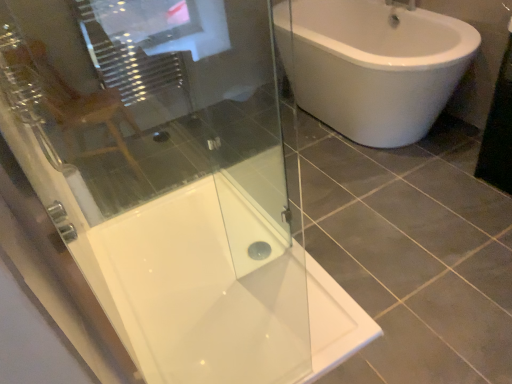
Describe the element at coordinates (78, 106) in the screenshot. I see `matte wooden chair at upper left` at that location.

The height and width of the screenshot is (384, 512). Describe the element at coordinates (165, 173) in the screenshot. I see `transparent glass shower door at upper left` at that location.

Where is `white glossy shower tray at center`? Image resolution: width=512 pixels, height=384 pixels. white glossy shower tray at center is located at coordinates (220, 299).

Where is `matte wooden chair at upper left`? The width and height of the screenshot is (512, 384). matte wooden chair at upper left is located at coordinates (78, 106).

From the image's perspective, who appears lower, matte wooden chair at upper left or transparent glass shower door at upper left?

transparent glass shower door at upper left.

Find the location of `gray behind the transparent glass shower door at upper left`. gray behind the transparent glass shower door at upper left is located at coordinates (78, 106).

Considering the sizes of objects matte wooden chair at upper left and transparent glass shower door at upper left in the image provided, who is shorter, matte wooden chair at upper left or transparent glass shower door at upper left?

matte wooden chair at upper left is shorter.

From a real-world perspective, which is physically below, matte wooden chair at upper left or transparent glass shower door at upper left?

From a 3D spatial view, matte wooden chair at upper left is below.

From the picture: Is transparent glass shower door at upper left next to white glossy shower tray at center?

No, transparent glass shower door at upper left is not with white glossy shower tray at center.

From the image's perspective, which is above, transparent glass shower door at upper left or white glossy shower tray at center?

transparent glass shower door at upper left, from the image's perspective.

From a real-world perspective, between transparent glass shower door at upper left and white glossy shower tray at center, who is vertically lower?

white glossy shower tray at center.

Considering the sizes of transparent glass shower door at upper left and white glossy shower tray at center in the image, is transparent glass shower door at upper left taller or shorter than white glossy shower tray at center?

transparent glass shower door at upper left is taller than white glossy shower tray at center.

Is transparent glass shower door at upper left inside or outside of matte wooden chair at upper left?

transparent glass shower door at upper left lies outside matte wooden chair at upper left.

Is transparent glass shower door at upper left placed right next to matte wooden chair at upper left?

No, transparent glass shower door at upper left is not next to matte wooden chair at upper left.

Looking at this image, in the image, is transparent glass shower door at upper left positioned in front of or behind matte wooden chair at upper left?

In the image, transparent glass shower door at upper left appears in front of matte wooden chair at upper left.

Can you see white glossy shower tray at center touching transparent glass shower door at upper left?

white glossy shower tray at center and transparent glass shower door at upper left are not in contact.

Consider the image. From a real-world perspective, is white glossy shower tray at center on transparent glass shower door at upper left?

Actually, white glossy shower tray at center is physically below transparent glass shower door at upper left in the real world.

Would you say white glossy shower tray at center contains transparent glass shower door at upper left?

Definitely not — transparent glass shower door at upper left is not inside white glossy shower tray at center.

Considering the positions of points (292, 263) and (121, 263), is point (292, 263) closer to camera compared to point (121, 263)?

Yes, it is.

Between white glossy shower tray at center and matte wooden chair at upper left, which one appears on the left side from the viewer's perspective?

Positioned to the left is matte wooden chair at upper left.

From a real-world perspective, between white glossy shower tray at center and matte wooden chair at upper left, who is vertically lower?

white glossy shower tray at center.

In terms of height, does white glossy shower tray at center look taller or shorter compared to matte wooden chair at upper left?

In the image, white glossy shower tray at center appears to be shorter than matte wooden chair at upper left.

Is white glossy shower tray at center placed right next to matte wooden chair at upper left?

white glossy shower tray at center and matte wooden chair at upper left are not in contact.

Is matte wooden chair at upper left turned away from white glossy shower tray at center?

No, white glossy shower tray at center is not at the back of matte wooden chair at upper left.

From a real-world perspective, does matte wooden chair at upper left sit lower than white glossy shower tray at center?

No, from a real-world perspective, matte wooden chair at upper left is not beneath white glossy shower tray at center.

Is the depth of matte wooden chair at upper left greater than that of white glossy shower tray at center?

Yes, matte wooden chair at upper left is further from the viewer.

You are a GUI agent. You are given a task and a screenshot of the screen. Output one action in this format:
    pyautogui.click(x=<x>, y=<y>)
    Task: Click on the screen door that is above the matte wooden chair at upper left (from a real-world perspective)
    This screenshot has width=512, height=384.
    Given the screenshot: What is the action you would take?
    click(x=165, y=173)

Find the location of `screen door above the white glossy shower tray at center (from the image's perspective)`. screen door above the white glossy shower tray at center (from the image's perspective) is located at coordinates (165, 173).

Looking at the image, which one is located closer to white glossy shower tray at center, matte wooden chair at upper left or transparent glass shower door at upper left?

transparent glass shower door at upper left is closer to white glossy shower tray at center.

From the image, which object appears to be farther from white glossy shower tray at center, transparent glass shower door at upper left or matte wooden chair at upper left?

Based on the image, matte wooden chair at upper left appears to be further to white glossy shower tray at center.

From the image, which object appears to be nearer to transparent glass shower door at upper left, white glossy shower tray at center or matte wooden chair at upper left?

white glossy shower tray at center.

When comparing their distances from matte wooden chair at upper left, does white glossy shower tray at center or transparent glass shower door at upper left seem closer?

transparent glass shower door at upper left.

Looking at the image, which one is located closer to transparent glass shower door at upper left, matte wooden chair at upper left or white glossy shower tray at center?

Based on the image, white glossy shower tray at center appears to be nearer to transparent glass shower door at upper left.

Consider the image. Looking at the image, which one is located closer to matte wooden chair at upper left, transparent glass shower door at upper left or white glossy shower tray at center?

The object closer to matte wooden chair at upper left is transparent glass shower door at upper left.

Where is `bath positioned between transparent glass shower door at upper left and matte wooden chair at upper left from near to far`? The height and width of the screenshot is (384, 512). bath positioned between transparent glass shower door at upper left and matte wooden chair at upper left from near to far is located at coordinates (220, 299).